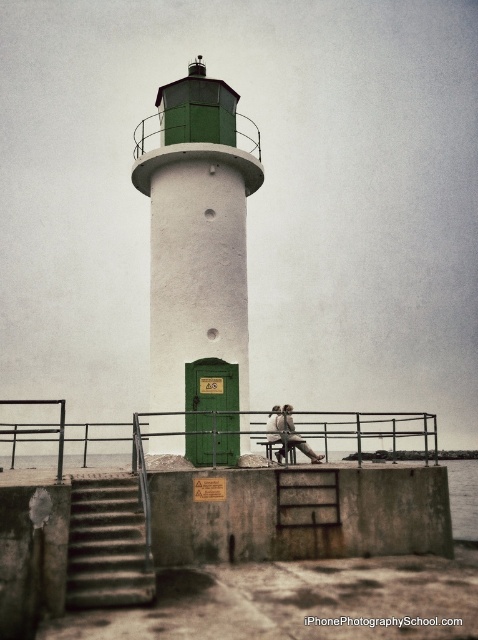
Between point (217, 310) and point (316, 461), which one is positioned behind?

Positioned behind is point (316, 461).

Is green matte/lightweight tower at center further to camera compared to matte brown leather bench at center?

No, green matte/lightweight tower at center is in front of matte brown leather bench at center.

At what (x,y) coordinates should I click in order to perform the action: click on green matte/lightweight tower at center. Please return your answer as a coordinate pair (x, y). Looking at the image, I should click on (198, 268).

Who is more distant from viewer, (191, 417) or (43, 429)?

Point (191, 417)

Is point (201, 202) less distant than point (10, 460)?

Yes, it is in front of point (10, 460).

Who is more forward, (212, 314) or (339, 428)?

Positioned in front is point (212, 314).

The image size is (478, 640). I want to click on green matte/lightweight tower at center, so click(x=198, y=268).

Is black metal railing at lower center to the right of matte brown leather bench at center from the viewer's perspective?

Incorrect, black metal railing at lower center is not on the right side of matte brown leather bench at center.

Does black metal railing at lower center have a larger size compared to matte brown leather bench at center?

Result: Yes.

Locate an element on the screen. This screenshot has height=640, width=478. black metal railing at lower center is located at coordinates (369, 432).